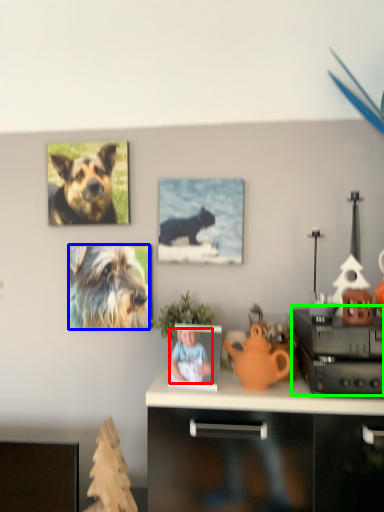
Question: Which object is the closest to the person (highlighted by a red box)? Choose among these: dog (highlighted by a blue box) or cabinetry (highlighted by a green box).

Choices:
 (A) dog
 (B) cabinetry

Answer: (B)